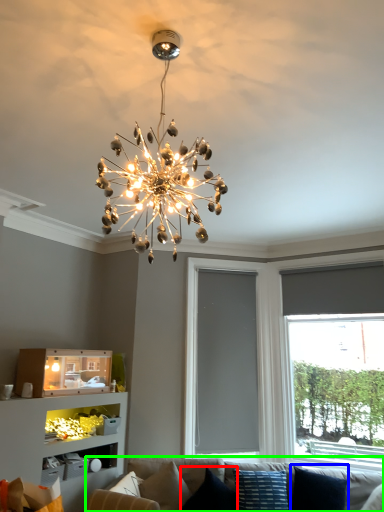
Question: Which object is the farthest from pillow (highlighted by a red box)? Choose among these: pillow (highlighted by a blue box) or studio couch (highlighted by a green box).

Choices:
 (A) pillow
 (B) studio couch

Answer: (A)